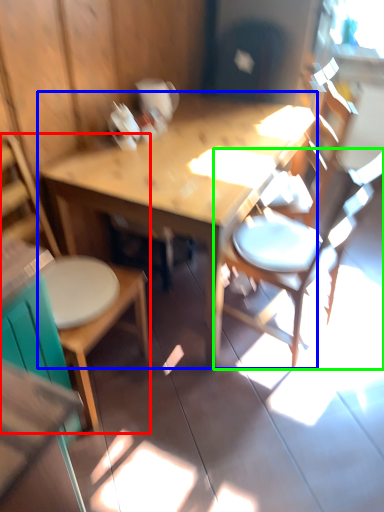
Question: Considering the real-world distances, which object is farthest from chair (highlighted by a red box)? table (highlighted by a blue box) or chair (highlighted by a green box)?

Choices:
 (A) table
 (B) chair

Answer: (B)